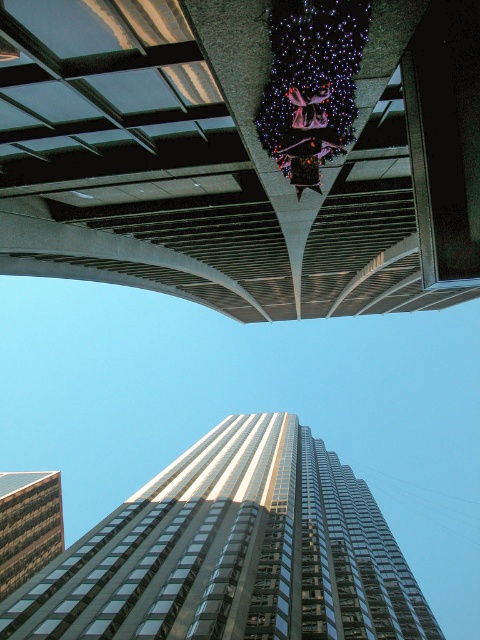
Can you confirm if reflective glass skyscraper at center is bigger than glassy reflective building at lower left?

Indeed, reflective glass skyscraper at center has a larger size compared to glassy reflective building at lower left.

Who is more forward, (x=347, y=499) or (x=12, y=566)?

Positioned in front is point (x=12, y=566).

Who is more forward, (349, 604) or (22, 499)?

Point (349, 604)

You are a GUI agent. You are given a task and a screenshot of the screen. Output one action in this format:
    pyautogui.click(x=<x>, y=<y>)
    Task: Click on the reflective glass skyscraper at center
    This screenshot has width=480, height=640.
    Given the screenshot: What is the action you would take?
    pyautogui.click(x=232, y=552)

In the scene shown: Is metallic gray overpass at upper center above reflective glass skyscraper at center?

Indeed, metallic gray overpass at upper center is positioned over reflective glass skyscraper at center.

Who is more distant from viewer, (64, 227) or (48, 609)?

The point (48, 609) is more distant.

Where is `metallic gray overpass at upper center`? The width and height of the screenshot is (480, 640). metallic gray overpass at upper center is located at coordinates (199, 163).

Is point (183, 276) more distant than point (49, 493)?

No.

Who is shorter, metallic gray overpass at upper center or glassy reflective building at lower left?

metallic gray overpass at upper center

Identify the location of metallic gray overpass at upper center. The width and height of the screenshot is (480, 640). (199, 163).